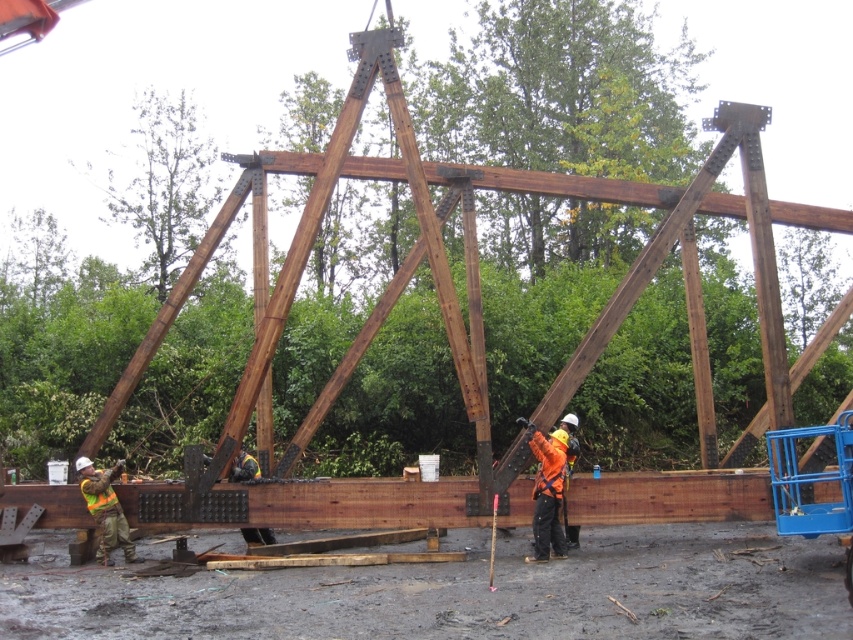
Question: Considering the relative positions of orange reflective vest at center and reflective orange safety vest at lower left in the image provided, where is orange reflective vest at center located with respect to reflective orange safety vest at lower left?

Choices:
 (A) right
 (B) left

Answer: (A)

Question: Estimate the real-world distances between objects in this image. Which object is closer to the reflective orange safety vest at lower left?

Choices:
 (A) reflective yellow safety vest at lower left
 (B) orange reflective vest at center

Answer: (A)

Question: Does orange reflective vest at center have a smaller size compared to reflective yellow safety vest at lower left?

Choices:
 (A) yes
 (B) no

Answer: (B)

Question: Which object appears farthest from the camera in this image?

Choices:
 (A) reflective yellow safety vest at lower left
 (B) orange reflective vest at center

Answer: (A)

Question: Among these points, which one is farthest from the camera?

Choices:
 (A) (83, 480)
 (B) (529, 438)
 (C) (105, 531)

Answer: (A)

Question: Can you confirm if orange reflective vest at center is bigger than reflective orange safety vest at lower left?

Choices:
 (A) yes
 (B) no

Answer: (B)